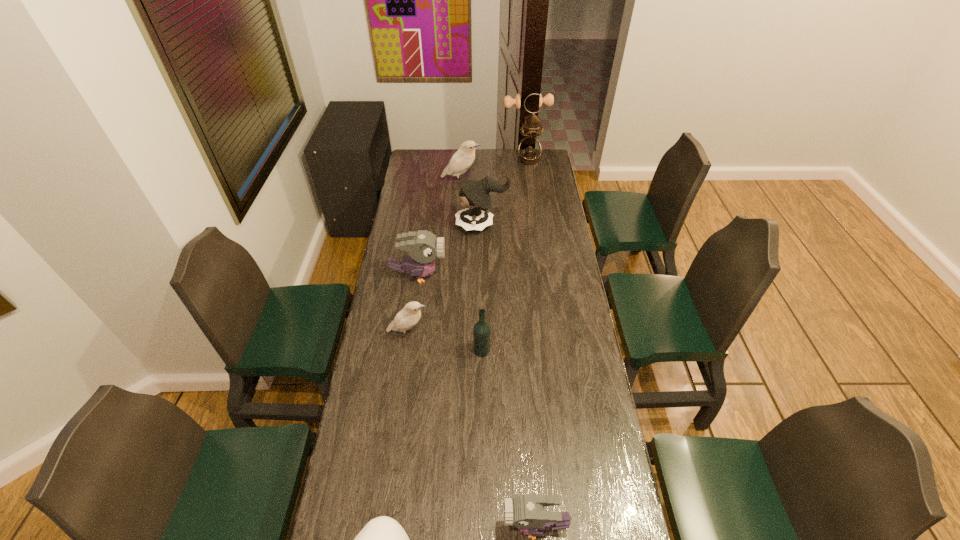
The width and height of the screenshot is (960, 540). Find the location of `vacant space located 0.190m at the beak of the second nearest bird`. vacant space located 0.190m at the beak of the second nearest bird is located at coordinates (479, 334).

The width and height of the screenshot is (960, 540). I want to click on free region located at the beak of the rightmost bird, so click(384, 526).

This screenshot has height=540, width=960. What are the coordinates of `blank area located 0.060m at the beak of the rightmost bird` in the screenshot? It's located at (481, 526).

The image size is (960, 540). Find the location of `free space located 0.230m at the beak of the rightmost bird`. free space located 0.230m at the beak of the rightmost bird is located at coordinates (420, 526).

Where is `object that is at the far edge`? Image resolution: width=960 pixels, height=540 pixels. object that is at the far edge is located at coordinates (529, 150).

This screenshot has height=540, width=960. I want to click on object located in the right edge section of the desktop, so click(529, 150).

At what (x,y) coordinates should I click in order to perform the action: click on object located at the far right corner. Please return your answer as a coordinate pair (x, y). This screenshot has width=960, height=540. Looking at the image, I should click on (529, 150).

In the image, there is a desktop. Where is `free space at the far edge`? free space at the far edge is located at coordinates (454, 150).

Locate an element on the screen. Image resolution: width=960 pixels, height=540 pixels. vacant space at the left edge is located at coordinates (402, 354).

Image resolution: width=960 pixels, height=540 pixels. I want to click on free spot at the right edge of the desktop, so point(534,236).